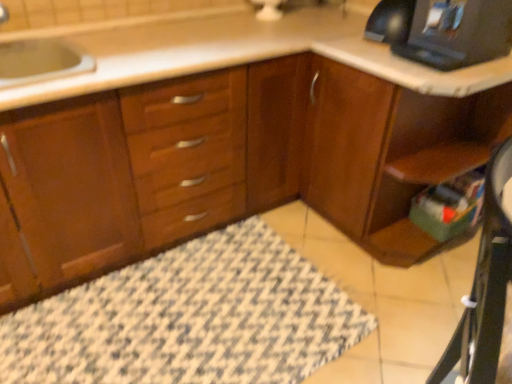
Locate an element on the screen. This screenshot has width=512, height=384. wooden cabinet at center is located at coordinates (227, 164).

What are the coordinates of `wooden cabinet at lower right` in the screenshot? It's located at (391, 154).

Describe the element at coordinates (391, 154) in the screenshot. I see `wooden cabinet at lower right` at that location.

What is the approximate width of patterned fabric bath mat at lower center?

patterned fabric bath mat at lower center is 31.76 inches wide.

The height and width of the screenshot is (384, 512). What do you see at coordinates (458, 33) in the screenshot? I see `black plastic desktop computer at upper right` at bounding box center [458, 33].

What are the coordinates of `wooden cabinet at center` in the screenshot? It's located at (227, 164).

Between point (425, 114) and point (467, 326), which one is positioned in front?

The point (467, 326) is in front.

From a real-world perspective, which is physically above, wooden cabinet at center or wooden computer desk at lower right?

wooden computer desk at lower right is physically above.

This screenshot has width=512, height=384. What are the coordinates of `computer desk below the wooden cabinet at center (from the image's perspective)` in the screenshot? It's located at (484, 286).

Would you consider wooden cabinet at center to be distant from wooden computer desk at lower right?

No, wooden cabinet at center is not far from wooden computer desk at lower right.

Is wooden cabinet at lower right facing away from black plastic desktop computer at upper right?

No.

Can you tell me how much wooden cabinet at lower right and black plastic desktop computer at upper right differ in facing direction?

The angular difference between wooden cabinet at lower right and black plastic desktop computer at upper right is 0.0125 degrees.

From the image's perspective, would you say wooden cabinet at lower right is positioned over black plastic desktop computer at upper right?

No, from the image's perspective, wooden cabinet at lower right is not on top of black plastic desktop computer at upper right.

Which is further, (366,177) or (464,27)?

The point (366,177) is more distant.

Considering the points (459, 1) and (362, 172), which point is in front, point (459, 1) or point (362, 172)?

The point (459, 1) is in front.

Is the depth of black plastic desktop computer at upper right greater than that of wooden cabinet at lower right?

Yes.

Is black plastic desktop computer at upper right facing towards wooden cabinet at lower right?

No, black plastic desktop computer at upper right is not turned towards wooden cabinet at lower right.

In the image, is wooden computer desk at lower right positioned in front of or behind black plastic desktop computer at upper right?

Visually, wooden computer desk at lower right is located in front of black plastic desktop computer at upper right.

Is point (490, 211) farther from viewer compared to point (433, 13)?

No, it is not.

This screenshot has width=512, height=384. In the image, there is a black plastic desktop computer at upper right. Identify the location of computer desk below it (from a real-world perspective). (484, 286).

Between wooden computer desk at lower right and black plastic desktop computer at upper right, which one has larger size?

wooden computer desk at lower right is bigger.

From the image's perspective, is patterned fabric bath mat at lower center above wooden cabinet at lower right?

No, from the image's perspective, patterned fabric bath mat at lower center is not over wooden cabinet at lower right.

Is patterned fabric bath mat at lower center facing away from wooden cabinet at lower right?

patterned fabric bath mat at lower center does not have its back to wooden cabinet at lower right.

How different are the orientations of patterned fabric bath mat at lower center and wooden cabinet at lower right in degrees?

They differ by 88.7 degrees in their facing directions.

Who is taller, patterned fabric bath mat at lower center or wooden cabinet at lower right?

With more height is wooden cabinet at lower right.

This screenshot has height=384, width=512. Identify the location of desktop computer behind the patterned fabric bath mat at lower center. (458, 33).

Is patterned fabric bath mat at lower center oriented away from black plastic desktop computer at upper right?

patterned fabric bath mat at lower center is not turned away from black plastic desktop computer at upper right.

Can you confirm if patterned fabric bath mat at lower center is taller than black plastic desktop computer at upper right?

Incorrect, the height of patterned fabric bath mat at lower center is not larger of that of black plastic desktop computer at upper right.

Who is smaller, patterned fabric bath mat at lower center or black plastic desktop computer at upper right?

With smaller size is black plastic desktop computer at upper right.

Which of these two, patterned fabric bath mat at lower center or wooden cabinet at center, is bigger?

Bigger between the two is wooden cabinet at center.

Is patterned fabric bath mat at lower center situated inside wooden cabinet at center or outside?

patterned fabric bath mat at lower center is located inside wooden cabinet at center.

Looking at this image, can you confirm if patterned fabric bath mat at lower center is thinner than wooden cabinet at center?

Indeed, patterned fabric bath mat at lower center has a lesser width compared to wooden cabinet at center.

Is patterned fabric bath mat at lower center at the left side of wooden cabinet at center?

Yes, patterned fabric bath mat at lower center is to the left of wooden cabinet at center.

Image resolution: width=512 pixels, height=384 pixels. I want to click on cabinetry located underneath the wooden computer desk at lower right (from a real-world perspective), so click(x=227, y=164).

Find the location of a particular element. This screenshot has width=512, height=384. dresser on the left of black plastic desktop computer at upper right is located at coordinates (391, 154).

Consider the image. Looking at the image, which one is located further to black plastic desktop computer at upper right, patterned fabric bath mat at lower center or wooden computer desk at lower right?

patterned fabric bath mat at lower center is positioned further to the anchor black plastic desktop computer at upper right.

In the scene shown: Which object lies further to the anchor point wooden computer desk at lower right, black plastic desktop computer at upper right or patterned fabric bath mat at lower center?

black plastic desktop computer at upper right.

Consider the image. Considering their positions, is wooden computer desk at lower right positioned further to wooden cabinet at center than wooden cabinet at lower right?

wooden computer desk at lower right lies further to wooden cabinet at center than the other object.

When comparing their distances from patterned fabric bath mat at lower center, does black plastic desktop computer at upper right or wooden cabinet at lower right seem closer?

wooden cabinet at lower right.

Looking at the image, which one is located closer to wooden computer desk at lower right, black plastic desktop computer at upper right or wooden cabinet at lower right?

Among the two, wooden cabinet at lower right is located nearer to wooden computer desk at lower right.

When comparing their distances from patterned fabric bath mat at lower center, does black plastic desktop computer at upper right or wooden computer desk at lower right seem further?

black plastic desktop computer at upper right is further to patterned fabric bath mat at lower center.

When comparing their distances from wooden computer desk at lower right, does wooden cabinet at center or black plastic desktop computer at upper right seem further?

Based on the image, black plastic desktop computer at upper right appears to be further to wooden computer desk at lower right.

Which object lies further to the anchor point patterned fabric bath mat at lower center, wooden computer desk at lower right or wooden cabinet at lower right?

The object further to patterned fabric bath mat at lower center is wooden computer desk at lower right.

You are a GUI agent. You are given a task and a screenshot of the screen. Output one action in this format:
    pyautogui.click(x=<x>, y=<y>)
    Task: Click on the dresser between black plastic desktop computer at upper right and patterned fabric bath mat at lower center vertically
    
    Given the screenshot: What is the action you would take?
    pyautogui.click(x=391, y=154)

Locate an element on the screen. cabinetry between wooden cabinet at lower right and patterned fabric bath mat at lower center in the up-down direction is located at coordinates (227, 164).

In order to click on dresser between wooden cabinet at center and black plastic desktop computer at upper right in this screenshot , I will do `click(391, 154)`.

Image resolution: width=512 pixels, height=384 pixels. I want to click on cabinetry between black plastic desktop computer at upper right and patterned fabric bath mat at lower center in the vertical direction, so click(x=227, y=164).